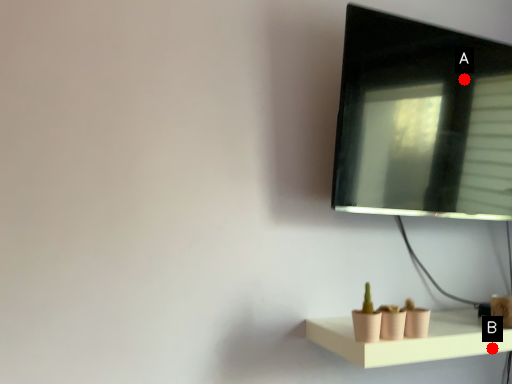
Question: Two points are circled on the image, labeled by A and B beside each circle. Among these points, which one is farthest from the camera?

Choices:
 (A) A is further
 (B) B is further

Answer: (A)